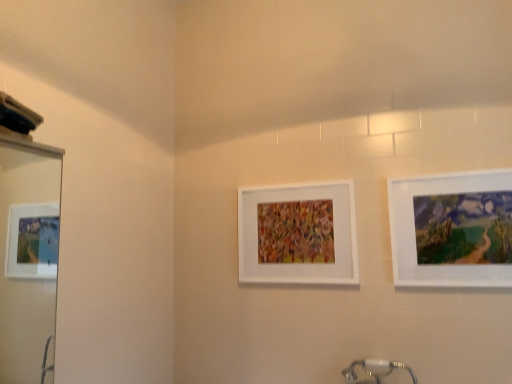
Question: Is white matte picture frame at center, which is counted as the first picture frame, starting from the left, at the back of matte white picture frame at right, the second picture frame in the back-to-front sequence?

Choices:
 (A) yes
 (B) no

Answer: (B)

Question: Is matte white picture frame at right, the 2th picture frame from the left, to the right of white matte picture frame at center, which is counted as the first picture frame, starting from the left, from the viewer's perspective?

Choices:
 (A) yes
 (B) no

Answer: (A)

Question: Does matte white picture frame at right, the 2th picture frame from the left, turn towards white matte picture frame at center, the 1th picture frame positioned from the back?

Choices:
 (A) yes
 (B) no

Answer: (B)

Question: Considering the relative sizes of matte white picture frame at right, the second picture frame in the back-to-front sequence, and white matte picture frame at center, which is counted as the first picture frame, starting from the left, in the image provided, is matte white picture frame at right, the second picture frame in the back-to-front sequence, smaller than white matte picture frame at center, which is counted as the first picture frame, starting from the left,?

Choices:
 (A) yes
 (B) no

Answer: (A)

Question: Is matte white picture frame at right, which is the 1th picture frame from front to back, positioned behind white matte picture frame at center, the 1th picture frame positioned from the back?

Choices:
 (A) no
 (B) yes

Answer: (A)

Question: Would you say matte white picture frame at right, the second picture frame in the back-to-front sequence, is to the left or to the right of white matte picture frame at center, the 2th picture frame from the right, in the picture?

Choices:
 (A) left
 (B) right

Answer: (B)

Question: From a real-world perspective, relative to white matte picture frame at center, arranged as the second picture frame when viewed from the front, is matte white picture frame at right, which is the 1th picture frame from front to back, vertically above or below?

Choices:
 (A) below
 (B) above

Answer: (A)

Question: Considering their positions, is matte white picture frame at right, the second picture frame in the back-to-front sequence, located in front of or behind white matte picture frame at center, which is counted as the first picture frame, starting from the left?

Choices:
 (A) behind
 (B) front

Answer: (B)

Question: Does point (423, 243) appear closer or farther from the camera than point (247, 211)?

Choices:
 (A) farther
 (B) closer

Answer: (B)

Question: From the image's perspective, is white glossy mirror at left above or below matte white picture frame at right, which is the 1th picture frame from front to back?

Choices:
 (A) below
 (B) above

Answer: (A)

Question: Is white glossy mirror at left taller or shorter than matte white picture frame at right, which is the 1th picture frame from front to back?

Choices:
 (A) short
 (B) tall

Answer: (B)

Question: Considering the positions of point (37, 296) and point (454, 266), is point (37, 296) closer or farther from the camera than point (454, 266)?

Choices:
 (A) farther
 (B) closer

Answer: (A)

Question: Based on their sizes in the image, would you say white glossy mirror at left is bigger or smaller than matte white picture frame at right, which is the 1th picture frame in right-to-left order?

Choices:
 (A) big
 (B) small

Answer: (A)

Question: Considering their positions, is white glossy mirror at left located in front of or behind white matte picture frame at center, the 2th picture frame from the right?

Choices:
 (A) front
 (B) behind

Answer: (A)

Question: Is white glossy mirror at left wider or thinner than white matte picture frame at center, arranged as the second picture frame when viewed from the front?

Choices:
 (A) wide
 (B) thin

Answer: (A)